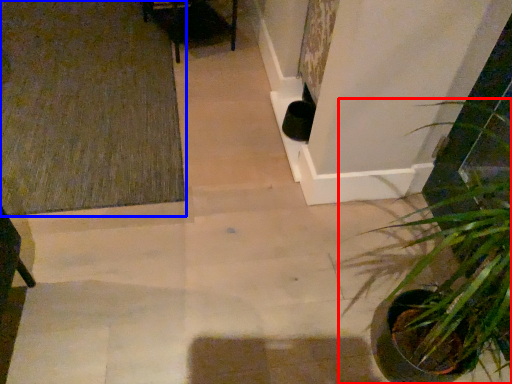
Question: Which object appears closest to the camera in this image, houseplant (highlighted by a red box) or doormat (highlighted by a blue box)?

Choices:
 (A) houseplant
 (B) doormat

Answer: (A)